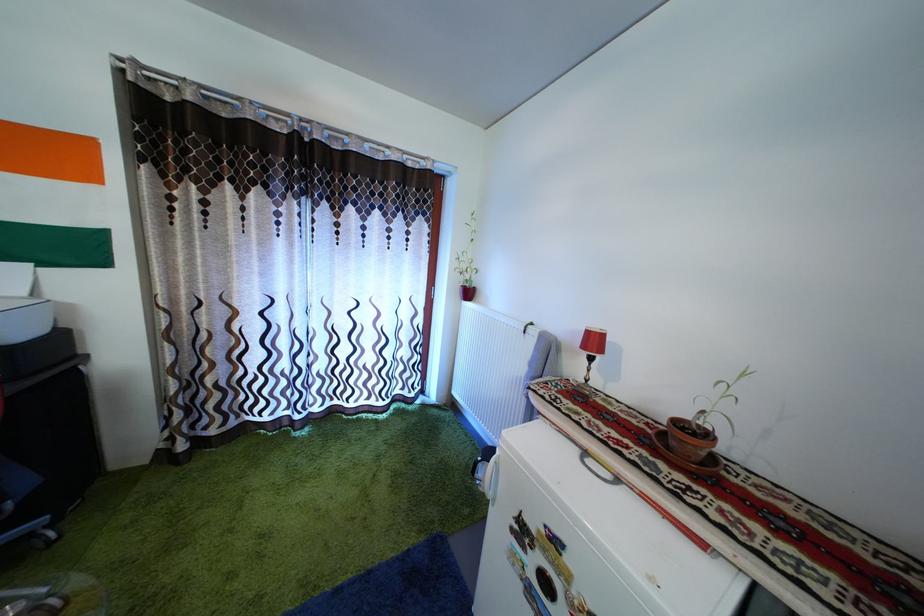
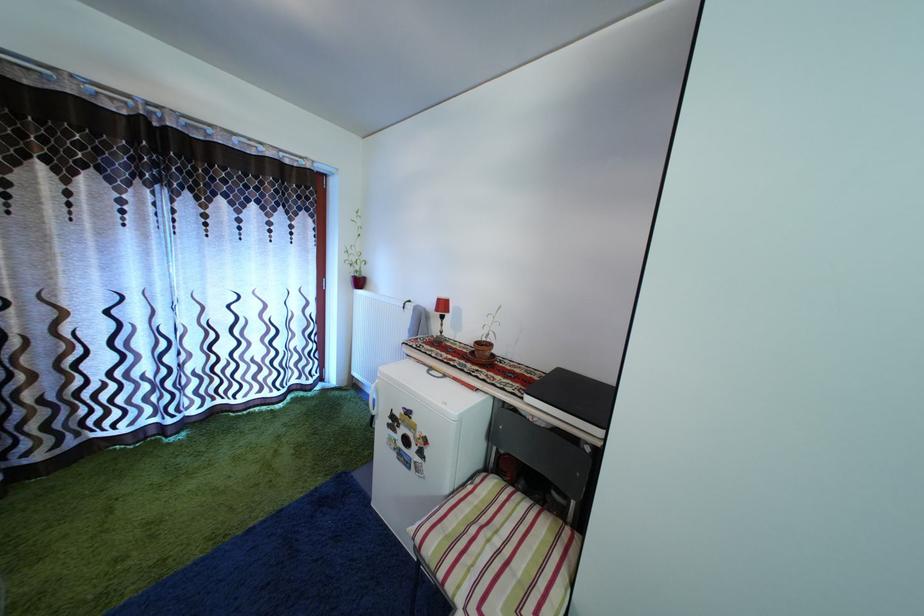
In the second image, find the point that corresponds to point 598,339 in the first image.

(446, 308)